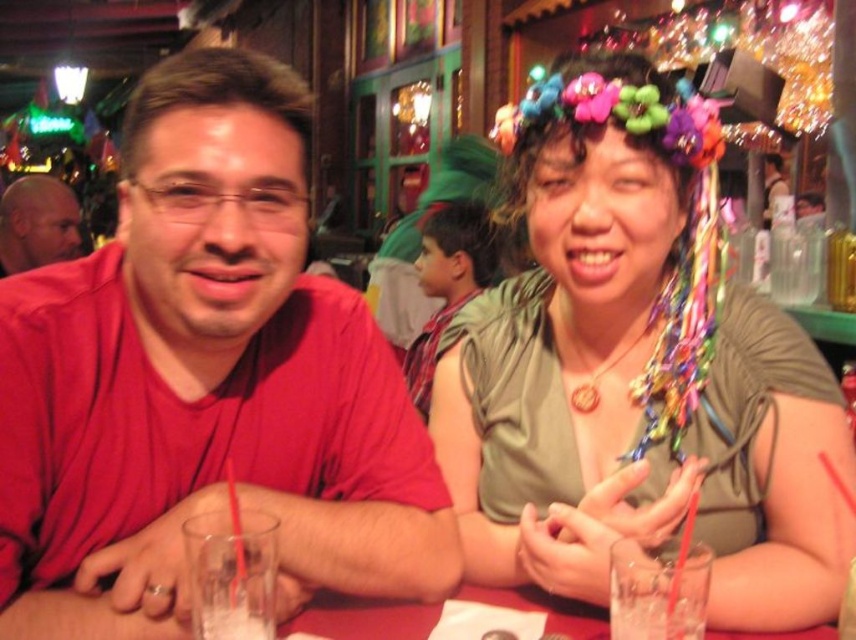
You are a waiter at the bar and need to place a new drink order on the table. Where should you place it so it doesn not interfere with the green fabric shirt at center and the clear glass at lower left?

The green fabric shirt at center is positioned over the clear glass at lower left, so you should place the new drink order on the table in an area that is not under the green fabric shirt at center and away from the clear glass at lower left to avoid interference.

You are a photographer setting up for a group photo. You need to ensure that both the matte red shirt at left and the translucent glass at lower right are clearly visible in the shot. Based on their positions, which object is closer to the left edge of the frame?

The matte red shirt at left is positioned on the left side of the translucent glass at lower right, so it is closer to the left edge of the frame.

You are a photographer setting up for a group photo. The green fabric shirt at center and the clear glass at lower left are in your frame. To ensure both items are fully visible, which one requires more horizontal space in the composition?

The green fabric shirt at center requires more horizontal space in the composition because it might be wider than the clear glass at lower left.